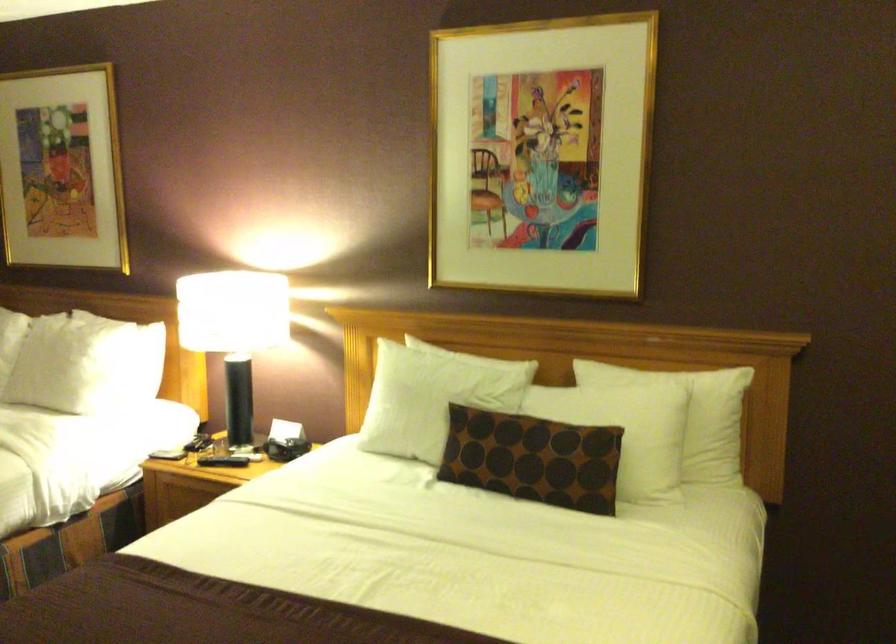
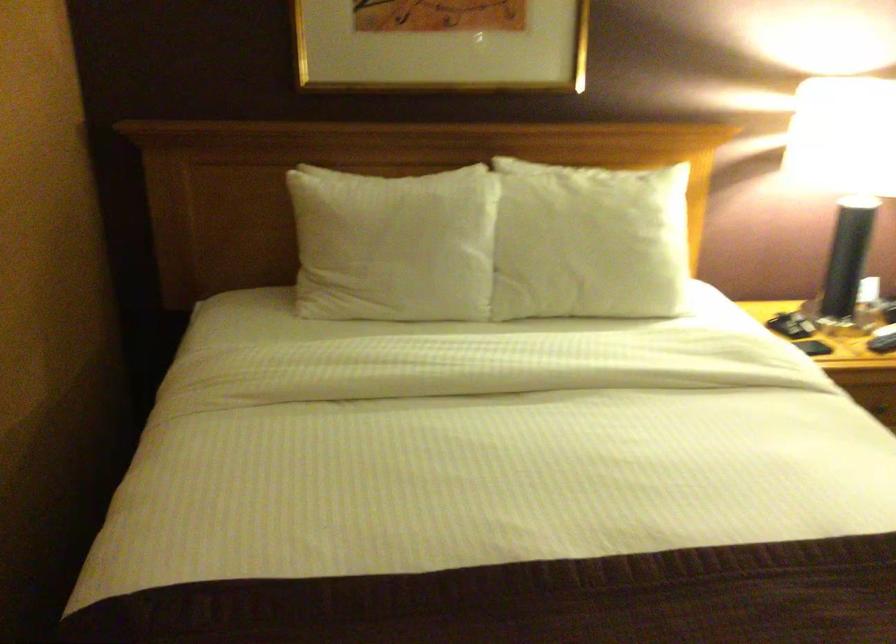
Find the pixel in the second image that matches [194,442] in the first image.

(782, 325)